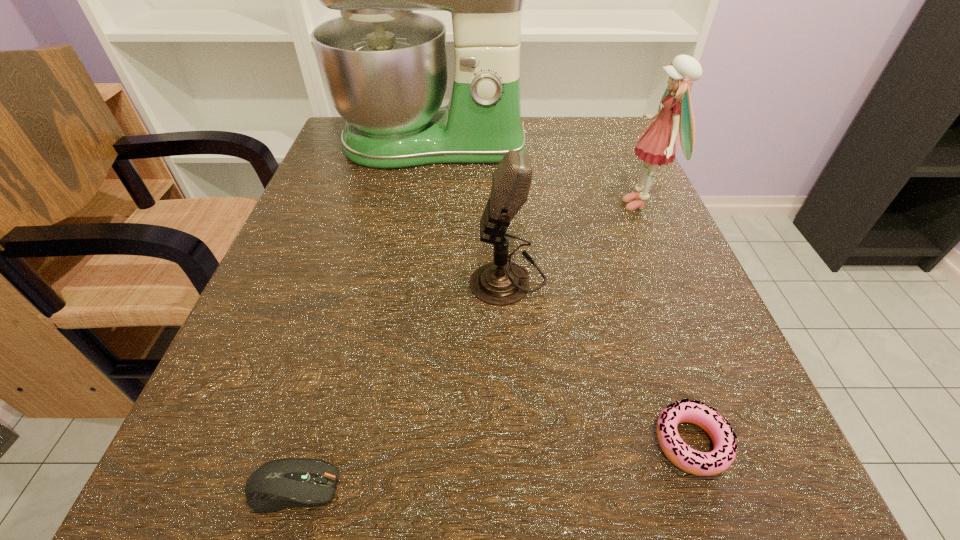
Find the location of a particular element. This screenshot has height=540, width=960. vacant space located 0.320m on the front-facing side of the doll is located at coordinates (443, 204).

Where is `blank space located 0.320m on the front-facing side of the doll`? The width and height of the screenshot is (960, 540). blank space located 0.320m on the front-facing side of the doll is located at coordinates (443, 204).

Where is `free space located 0.110m on the front-facing side of the third shortest object`? free space located 0.110m on the front-facing side of the third shortest object is located at coordinates (397, 278).

You are a GUI agent. You are given a task and a screenshot of the screen. Output one action in this format:
    pyautogui.click(x=<x>, y=<y>)
    Task: Click on the vacant area situated on the front-facing side of the third shortest object
    
    Given the screenshot: What is the action you would take?
    pyautogui.click(x=324, y=278)

Identify the location of vacant space situated 0.310m on the front-facing side of the third shortest object. This screenshot has height=540, width=960. (265, 278).

In order to click on vacant region located on the button of the computer equipment in this screenshot , I will do (582, 488).

This screenshot has height=540, width=960. I want to click on free space located on the left of the doughnut, so click(x=546, y=443).

Identify the location of object positioned at the far edge. (384, 67).

Where is `computer equipment positioned at the near edge`? The height and width of the screenshot is (540, 960). computer equipment positioned at the near edge is located at coordinates (278, 484).

At what (x,y) coordinates should I click in order to perform the action: click on doughnut that is at the near edge. Please return your answer as a coordinate pair (x, y). The image size is (960, 540). Looking at the image, I should click on (689, 460).